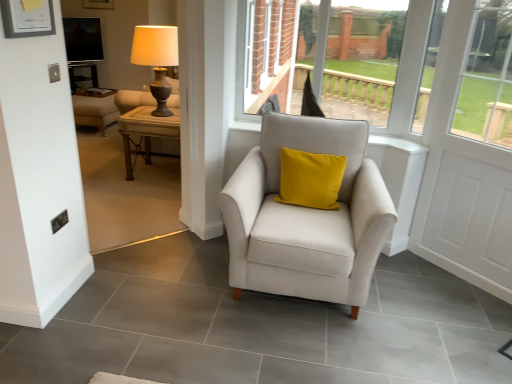
Question: Is there a large distance between woodenmaterial/texturetable at left and matte gold table lamp at upper left?

Choices:
 (A) no
 (B) yes

Answer: (A)

Question: Would you say woodenmaterial/texturetable at left contains matte gold table lamp at upper left?

Choices:
 (A) no
 (B) yes

Answer: (A)

Question: Can you confirm if woodenmaterial/texturetable at left is shorter than matte gold table lamp at upper left?

Choices:
 (A) no
 (B) yes

Answer: (B)

Question: From a real-world perspective, is woodenmaterial/texturetable at left below matte gold table lamp at upper left?

Choices:
 (A) yes
 (B) no

Answer: (A)

Question: From the image's perspective, is woodenmaterial/texturetable at left above matte gold table lamp at upper left?

Choices:
 (A) no
 (B) yes

Answer: (A)

Question: Considering the relative sizes of woodenmaterial/texturetable at left and matte gold table lamp at upper left in the image provided, is woodenmaterial/texturetable at left bigger than matte gold table lamp at upper left?

Choices:
 (A) no
 (B) yes

Answer: (B)

Question: Does white wooden screen door at right have a lesser height compared to matte wood table at left?

Choices:
 (A) yes
 (B) no

Answer: (B)

Question: Does white wooden screen door at right appear on the left side of matte wood table at left?

Choices:
 (A) yes
 (B) no

Answer: (B)

Question: Does white wooden screen door at right have a smaller size compared to matte wood table at left?

Choices:
 (A) yes
 (B) no

Answer: (A)

Question: From the image's perspective, does white wooden screen door at right appear lower than matte wood table at left?

Choices:
 (A) no
 (B) yes

Answer: (B)

Question: Is white wooden screen door at right turned away from matte wood table at left?

Choices:
 (A) yes
 (B) no

Answer: (B)

Question: Considering the relative sizes of white wooden screen door at right and matte wood table at left in the image provided, is white wooden screen door at right thinner than matte wood table at left?

Choices:
 (A) no
 (B) yes

Answer: (B)

Question: From a real-world perspective, is woodenmaterial/texturetable at left physically below white wooden screen door at right?

Choices:
 (A) yes
 (B) no

Answer: (A)